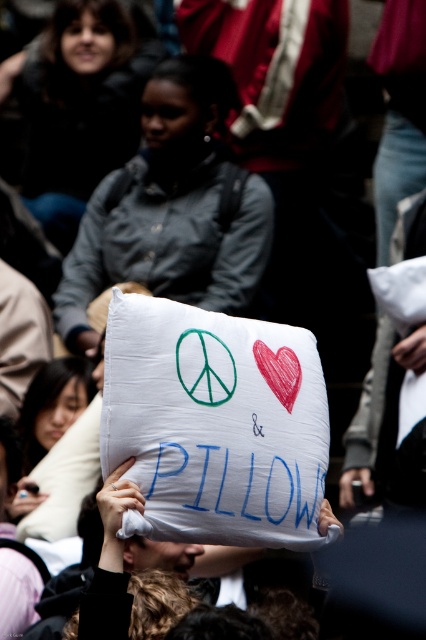
You are a photographer adjusting your camera focus. You need to focus on both the green peace symbol and the red heart on the white pillow. The green peace symbol is at point (48,502) and the red heart is at point (288,401). Which point should you focus on first to ensure both are in focus?

You should focus on point (48,502) first because it is closer to the camera than point (288,401). By focusing on the closer point, the depth of field will also cover the farther point, ensuring both symbols are in focus.

You are a photographer trying to capture the gray fabric pillow at center in your image. According to the scene description, where should you focus your camera to ensure the pillow is in the sharpest part of your photo?

The gray fabric pillow at center is positioned at point [170,209], so you should focus your camera at those coordinates to ensure it is in the sharpest part of your photo.

You are a photographer trying to capture the white soft pillow at center clearly. However, the dark gray jacket at upper left is blocking your view. Can you move around to the right side to get a better shot without the jacket blocking the pillow?

The dark gray jacket at upper left is further to the viewer than the white soft pillow at center, so moving to the right side might not help because the jacket is closer and blocking the view. You might need to move forward or backward to adjust your angle.